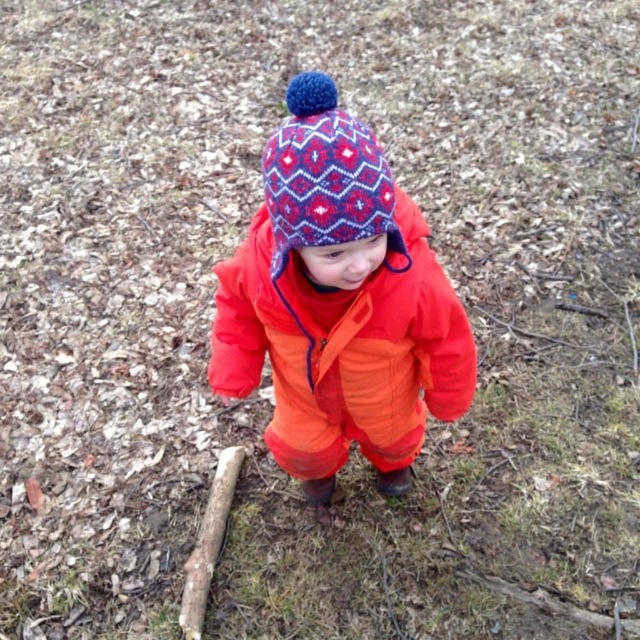
Looking at this image, you are a photographer trying to capture the child in the center of the frame. The camera you are using has a focus point at the center. Given that the matte orange snowsuit at center is exactly at point (339, 305), will the child be in focus?

The matte orange snowsuit at center is represented by point (339, 305), so yes, since the focus point is at the center, the child will be in focus.

You are a photographer trying to capture the child in the forest scene. You notice the matte orange snowsuit at center and the knitted woolen hat at center. Which object should you focus on first to ensure it is in sharp focus if you want the one closer to the camera to be clear?

The matte orange snowsuit at center is in front of the knitted woolen hat at center, so you should focus on the matte orange snowsuit at center first to ensure it is in sharp focus since it is closer to the camera.